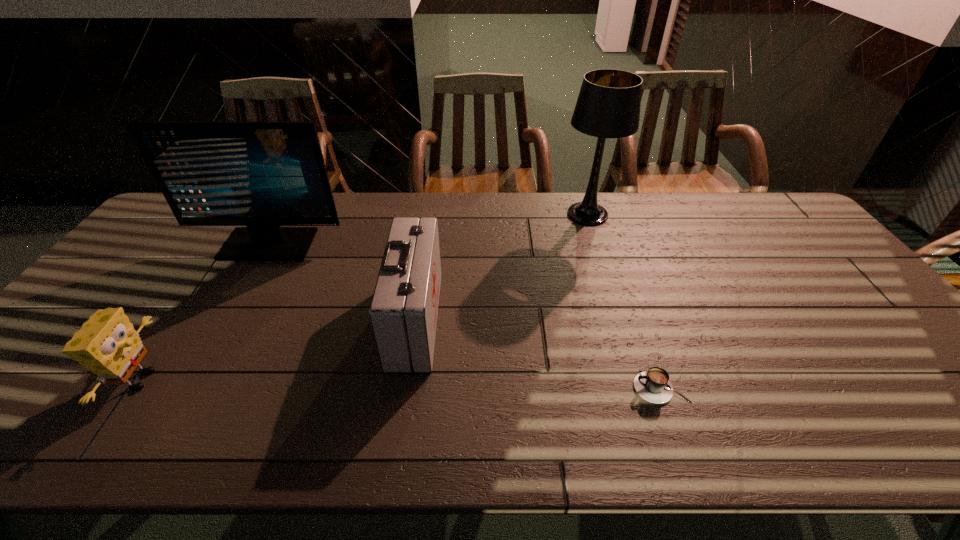
The image size is (960, 540). What are the coordinates of `free space that is in between the fourth tallest object and the table lamp` in the screenshot? It's located at (365, 297).

Image resolution: width=960 pixels, height=540 pixels. Identify the location of free point between the second shortest object and the table lamp. (365, 297).

This screenshot has width=960, height=540. What are the coordinates of `free space between the monitor and the sponge` in the screenshot? It's located at (205, 312).

You are a GUI agent. You are given a task and a screenshot of the screen. Output one action in this format:
    pyautogui.click(x=<x>, y=<y>)
    Task: Click on the free space between the monitor and the shortest object
    The width and height of the screenshot is (960, 540).
    Given the screenshot: What is the action you would take?
    tap(465, 316)

Locate an element on the screen. empty location between the monitor and the first-aid kit is located at coordinates (342, 282).

I want to click on empty space that is in between the cappuccino and the table lamp, so click(624, 301).

This screenshot has width=960, height=540. I want to click on free area in between the sponge and the third object from right to left, so click(278, 350).

Find the location of a particular element. Image resolution: width=960 pixels, height=540 pixels. free space that is in between the third object from left to right and the sponge is located at coordinates (278, 350).

You are a GUI agent. You are given a task and a screenshot of the screen. Output one action in this format:
    pyautogui.click(x=<x>, y=<y>)
    Task: Click on the vacant region between the table lamp and the fourth tallest object
    The width and height of the screenshot is (960, 540).
    Given the screenshot: What is the action you would take?
    pyautogui.click(x=365, y=297)

Identify which object is the third closest to the first-aid kit. Please provide its 2D coordinates. Your answer should be formatted as a tuple, i.e. [(x, y)], where the tuple contains the x and y coordinates of a point satisfying the conditions above.

[(653, 385)]